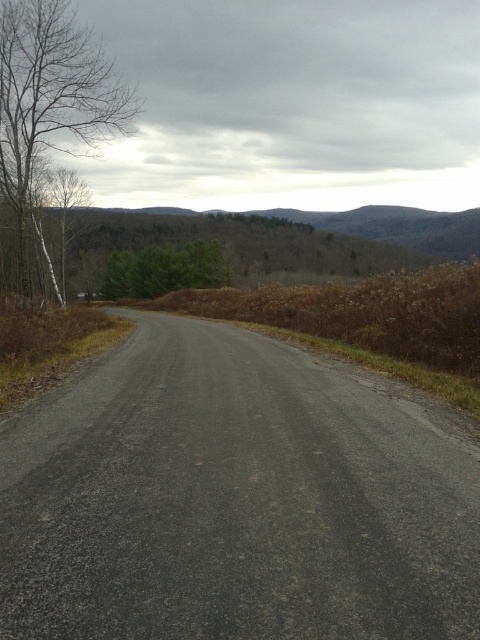
You are standing on the rural road and see two points marked on the ground. The first point is at coordinates point (202, 237) and the second point is at point (69, 116). Which point is closer to your current position?

Point (69, 116) is closer to your current position because it is nearer to the camera compared to point (202, 237), which is further away.